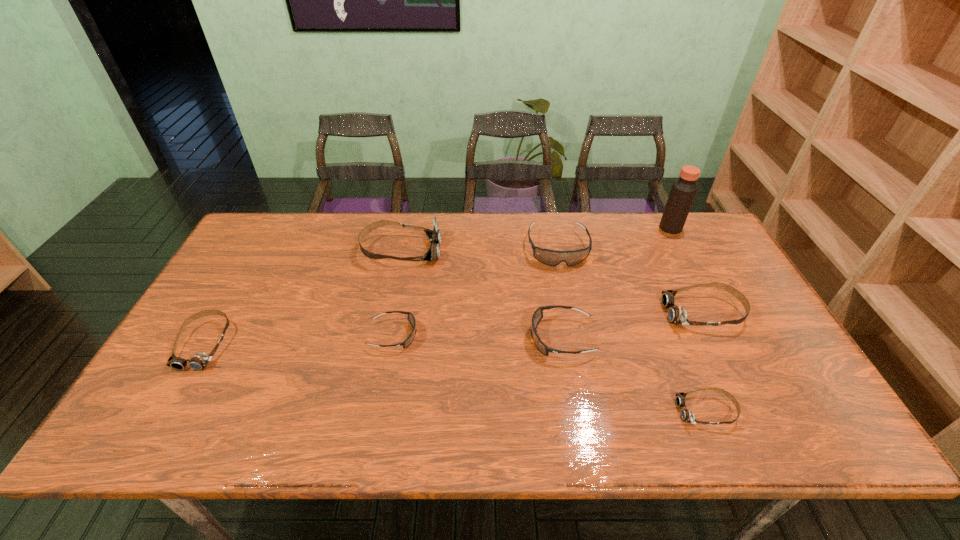
You are a GUI agent. You are given a task and a screenshot of the screen. Output one action in this format:
    pyautogui.click(x=<x>, y=<y>)
    Task: Click on the goggles that is at the right edge
    The width and height of the screenshot is (960, 540).
    Given the screenshot: What is the action you would take?
    pyautogui.click(x=676, y=315)

This screenshot has height=540, width=960. In order to click on object present at the far right corner in this screenshot , I will do `click(683, 191)`.

Where is `blank space at the far edge of the desktop`? blank space at the far edge of the desktop is located at coordinates (551, 232).

The image size is (960, 540). What are the coordinates of `free space at the near edge of the desktop` in the screenshot? It's located at (593, 411).

In the image, there is a desktop. Where is `free space at the left edge`? free space at the left edge is located at coordinates (246, 299).

You are a GUI agent. You are given a task and a screenshot of the screen. Output one action in this format:
    pyautogui.click(x=<x>, y=<y>)
    Task: Click on the vacant space at the right edge of the desktop
    The image size is (960, 540).
    Given the screenshot: What is the action you would take?
    pyautogui.click(x=804, y=388)

The height and width of the screenshot is (540, 960). Find the location of `vacant space at the far left corner of the desktop`. vacant space at the far left corner of the desktop is located at coordinates (285, 213).

Where is `free space at the near left corner of the desktop`? The width and height of the screenshot is (960, 540). free space at the near left corner of the desktop is located at coordinates (191, 430).

The width and height of the screenshot is (960, 540). Find the location of `empty space that is in between the leftmost object and the second biggest black goggles`. empty space that is in between the leftmost object and the second biggest black goggles is located at coordinates (383, 341).

In order to click on vacant region between the farthest black goggles and the seventh shortest object in this screenshot , I will do `click(479, 249)`.